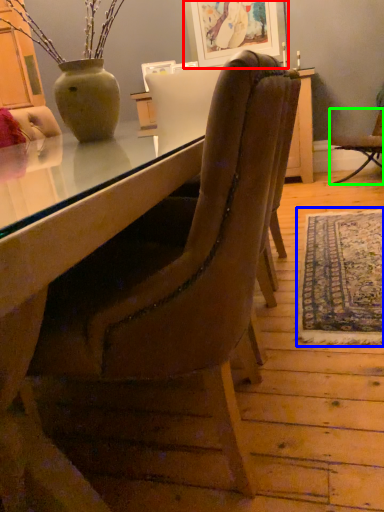
Question: Which is farther away from picture frame (highlighted by a red box)? mat (highlighted by a blue box) or chair (highlighted by a green box)?

Choices:
 (A) mat
 (B) chair

Answer: (A)